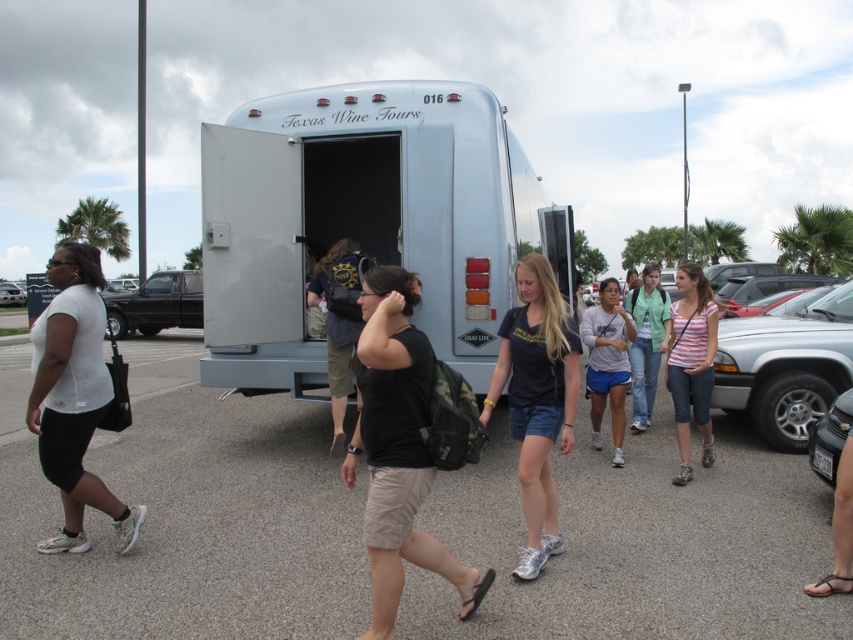
Question: Based on their relative distances, which object is farther from the white matte shirt at left?

Choices:
 (A) gray cotton shirt at center
 (B) matte black truck at left

Answer: (B)

Question: Can you confirm if dark blue t-shirt at center is wider than gray cotton shirt at center?

Choices:
 (A) no
 (B) yes

Answer: (A)

Question: Which object is the closest to the gray cotton shirt at center?

Choices:
 (A) matte black truck at left
 (B) striped cotton shirt at center
 (C) black matte shirt at center
 (D) dark blue t-shirt at center

Answer: (B)

Question: Which point is farther from the camera taking this photo?

Choices:
 (A) (402, 145)
 (B) (836, 358)

Answer: (B)

Question: Does dark blue t-shirt at center appear under striped cotton shirt at center?

Choices:
 (A) yes
 (B) no

Answer: (A)

Question: Can you confirm if white metallic bus at center is bigger than matte black truck at left?

Choices:
 (A) yes
 (B) no

Answer: (B)